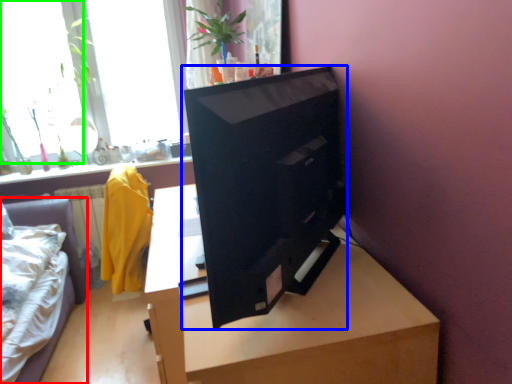
Question: Which is farther away from furniture (highlighted by a red box)? computer monitor (highlighted by a blue box) or window (highlighted by a green box)?

Choices:
 (A) computer monitor
 (B) window

Answer: (A)